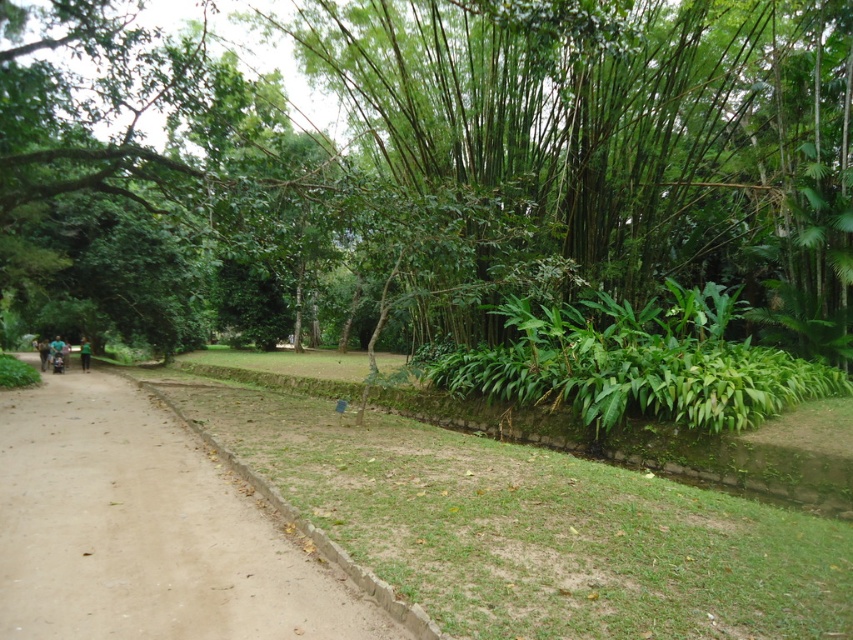
Question: Which point is closer to the camera?

Choices:
 (A) (49, 358)
 (B) (39, 340)
 (C) (49, 540)
 (D) (84, 356)

Answer: (C)

Question: Does green fabric person at center lie in front of green fabric person at left?

Choices:
 (A) yes
 (B) no

Answer: (B)

Question: Which object appears farthest from the camera in this image?

Choices:
 (A) brown dirt track at center
 (B) green leafy plants at center
 (C) green fabric stroller at left
 (D) green fabric person at center

Answer: (D)

Question: Is brown dirt track at center below green fabric person at center?

Choices:
 (A) no
 (B) yes

Answer: (B)

Question: Is green fabric stroller at left to the left of green fabric person at center from the viewer's perspective?

Choices:
 (A) yes
 (B) no

Answer: (A)

Question: Among these points, which one is nearest to the camera?

Choices:
 (A) (44, 368)
 (B) (717, 291)
 (C) (64, 349)
 (D) (83, 355)

Answer: (B)